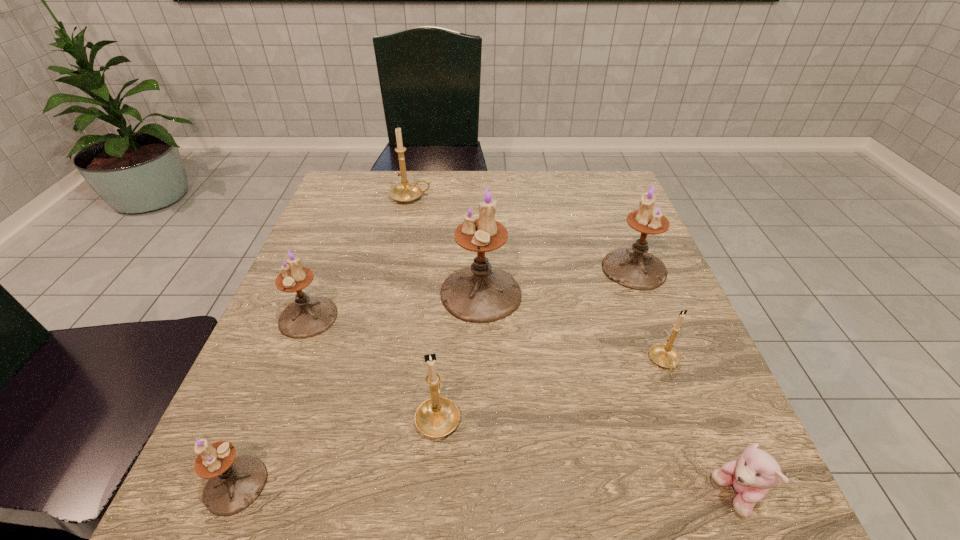
The width and height of the screenshot is (960, 540). Identify the location of the second purple candle holder from right to left. (481, 293).

This screenshot has width=960, height=540. Identify the location of the biggest purple candle holder. (481, 293).

The image size is (960, 540). In order to click on the biggest gold candle holder in this screenshot , I will do `click(405, 192)`.

Locate an element on the screen. This screenshot has height=540, width=960. the farthest object is located at coordinates (405, 192).

Locate an element on the screen. This screenshot has width=960, height=540. the second biggest purple candle holder is located at coordinates (634, 268).

The height and width of the screenshot is (540, 960). I want to click on the second smallest purple candle holder, so click(306, 317).

Find the location of a particular element. The height and width of the screenshot is (540, 960). the second smallest gold candle holder is located at coordinates (436, 417).

Where is `the sixth farthest object`? This screenshot has height=540, width=960. the sixth farthest object is located at coordinates (436, 417).

Where is `the smallest gold candle holder`? the smallest gold candle holder is located at coordinates (663, 355).

Where is `the fourth nearest object`? Image resolution: width=960 pixels, height=540 pixels. the fourth nearest object is located at coordinates (663, 355).